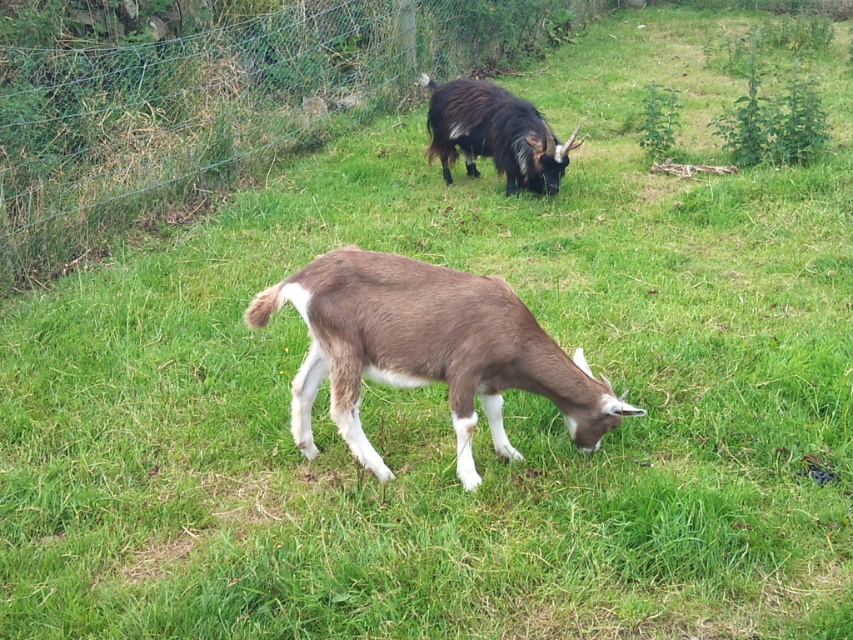
You are a farmer checking the fence in the field. You notice the metal wire fence at upper center and the dark brown woolen goat at upper center. Which object is smaller in size?

The metal wire fence at upper center has a smaller size compared to the dark brown woolen goat at upper center, so the metal wire fence at upper center is smaller.

You are standing at the center of the field and want to reach the metal wire fence at upper center. Which direction should you walk to get there?

The metal wire fence at upper center is located at point (222, 106), so you should walk towards the upper center direction to reach it.